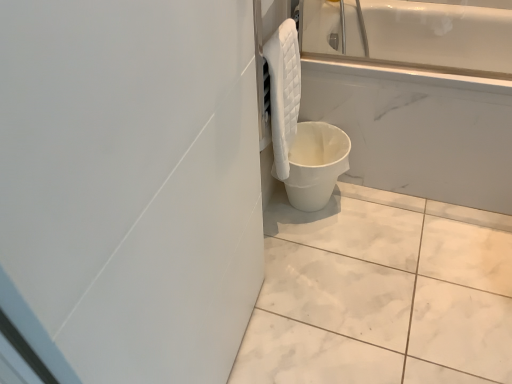
Question: Does white matte bucket at lower right lie in front of white marble tile at lower center?

Choices:
 (A) yes
 (B) no

Answer: (B)

Question: From the image's perspective, is white matte bucket at lower right beneath white marble tile at lower center?

Choices:
 (A) no
 (B) yes

Answer: (A)

Question: From the image's perspective, is white matte bucket at lower right over white marble tile at lower center?

Choices:
 (A) yes
 (B) no

Answer: (A)

Question: From a real-world perspective, does white matte bucket at lower right stand above white marble tile at lower center?

Choices:
 (A) no
 (B) yes

Answer: (B)

Question: Is white matte bucket at lower right smaller than white marble tile at lower center?

Choices:
 (A) yes
 (B) no

Answer: (B)

Question: Does point (289, 67) appear closer or farther from the camera than point (415, 221)?

Choices:
 (A) farther
 (B) closer

Answer: (B)

Question: From the image's perspective, is white quilted towel at upper right located above or below white marble tile at lower center?

Choices:
 (A) above
 (B) below

Answer: (A)

Question: In terms of height, does white quilted towel at upper right look taller or shorter compared to white marble tile at lower center?

Choices:
 (A) short
 (B) tall

Answer: (B)

Question: Considering the positions of white quilted towel at upper right and white marble tile at lower center in the image, is white quilted towel at upper right wider or thinner than white marble tile at lower center?

Choices:
 (A) thin
 (B) wide

Answer: (A)

Question: From their relative heights in the image, would you say white marble tile at lower center is taller or shorter than white quilted towel at upper right?

Choices:
 (A) tall
 (B) short

Answer: (B)

Question: Relative to white quilted towel at upper right, is white marble tile at lower center in front or behind?

Choices:
 (A) behind
 (B) front

Answer: (B)

Question: Is white marble tile at lower center inside the boundaries of white quilted towel at upper right, or outside?

Choices:
 (A) outside
 (B) inside

Answer: (A)

Question: From a real-world perspective, is white marble tile at lower center positioned above or below white quilted towel at upper right?

Choices:
 (A) below
 (B) above

Answer: (A)

Question: From a real-world perspective, is white matte bucket at lower right above or below white marble tile at lower center?

Choices:
 (A) below
 (B) above

Answer: (B)

Question: Considering their positions, is white matte bucket at lower right located in front of or behind white marble tile at lower center?

Choices:
 (A) front
 (B) behind

Answer: (B)